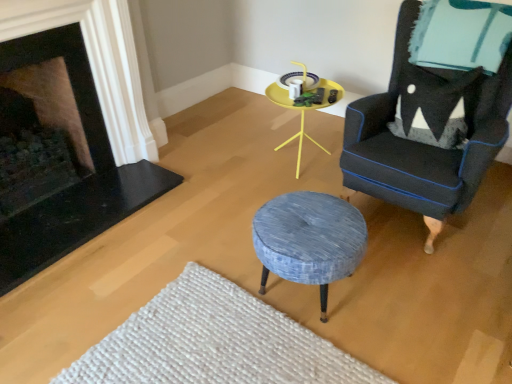
This screenshot has width=512, height=384. Identify the location of vacant space to the right of white textured rug at lower center. (420, 307).